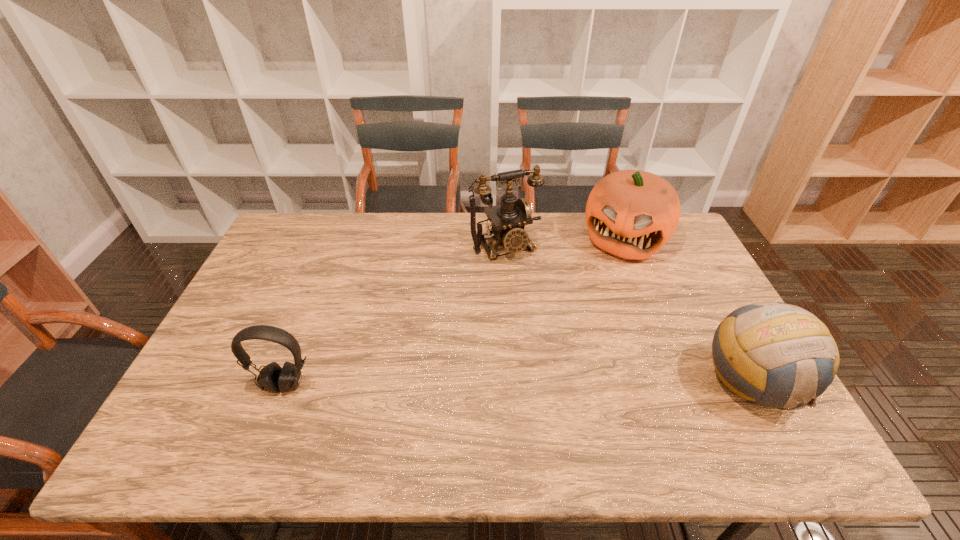
Find the location of a particular element. This screenshot has height=540, width=960. headset is located at coordinates (272, 378).

The height and width of the screenshot is (540, 960). I want to click on volleyball, so click(774, 354).

The height and width of the screenshot is (540, 960). Identify the location of the third object from right to left. (508, 219).

Locate an element on the screen. The image size is (960, 540). pumpkin is located at coordinates (631, 214).

This screenshot has height=540, width=960. Find the location of `blank area located 0.370m on the left of the volleyball`. blank area located 0.370m on the left of the volleyball is located at coordinates (555, 382).

Locate an element on the screen. The height and width of the screenshot is (540, 960). vacant space located 0.390m on the rotary dial of the second object from left to right is located at coordinates (573, 352).

What are the coordinates of `vacant space located 0.050m on the rotary dial of the second object from left to right` in the screenshot? It's located at (523, 272).

Identify the location of vacant space located 0.360m on the rotary dial of the second object from left to right. (567, 344).

This screenshot has height=540, width=960. What are the coordinates of `vacant space located 0.210m on the face of the pumpkin` in the screenshot? It's located at (595, 303).

At what (x,y) coordinates should I click in order to perform the action: click on free space located on the face of the pumpkin. Please return your answer as a coordinate pair (x, y). Image resolution: width=960 pixels, height=540 pixels. Looking at the image, I should click on (603, 287).